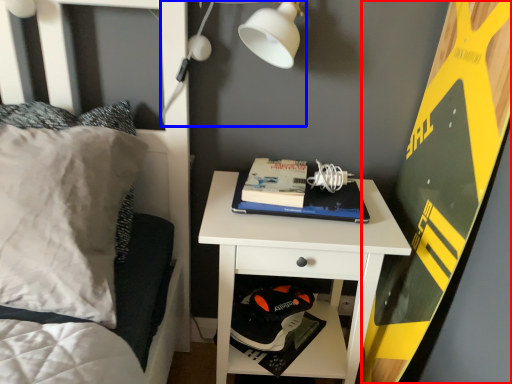
Question: Among these objects, which one is farthest to the camera, bulletin board (highlighted by a red box) or light fixture (highlighted by a blue box)?

Choices:
 (A) bulletin board
 (B) light fixture

Answer: (B)